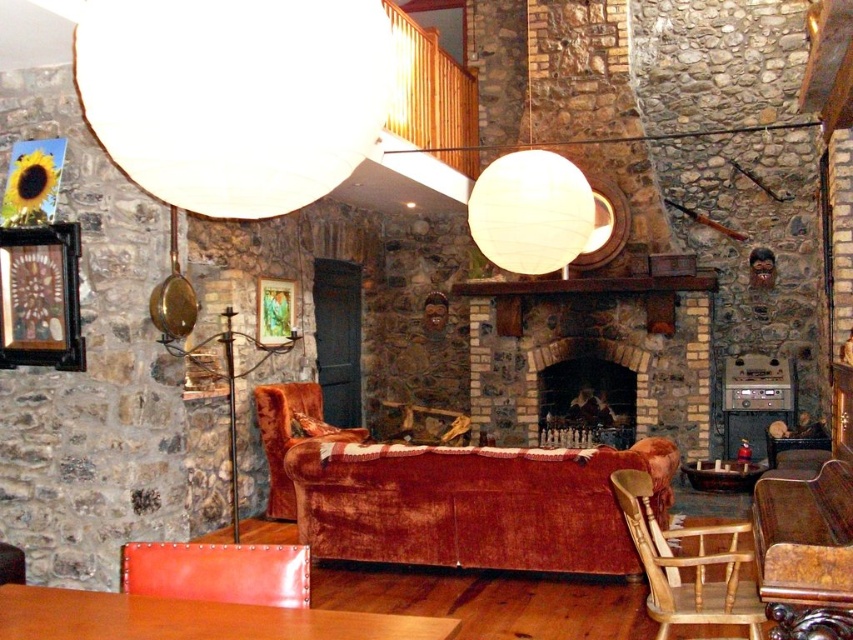
You are an interior designer planning to place a large decorative item in the living room. You have a white matte sphere at upper center and a leather armchair at lower left. Which object is larger and should be placed in a more spacious area?

The white matte sphere at upper center is bigger than the leather armchair at lower left, so it should be placed in a more spacious area to accommodate its size.

Consider the image. You are an interior designer planning to place a new piece of furniture in this rustic living room. You have a tall bookshelf that needs to be positioned between the white matte sphere at upper center and the leather armchair at lower left. Based on their positions, can you determine which object you should place the bookshelf closer to?

The white matte sphere at upper center is closer to the viewer than the leather armchair at lower left, so you should place the bookshelf closer to the leather armchair at lower left to maintain balance in the room layout.